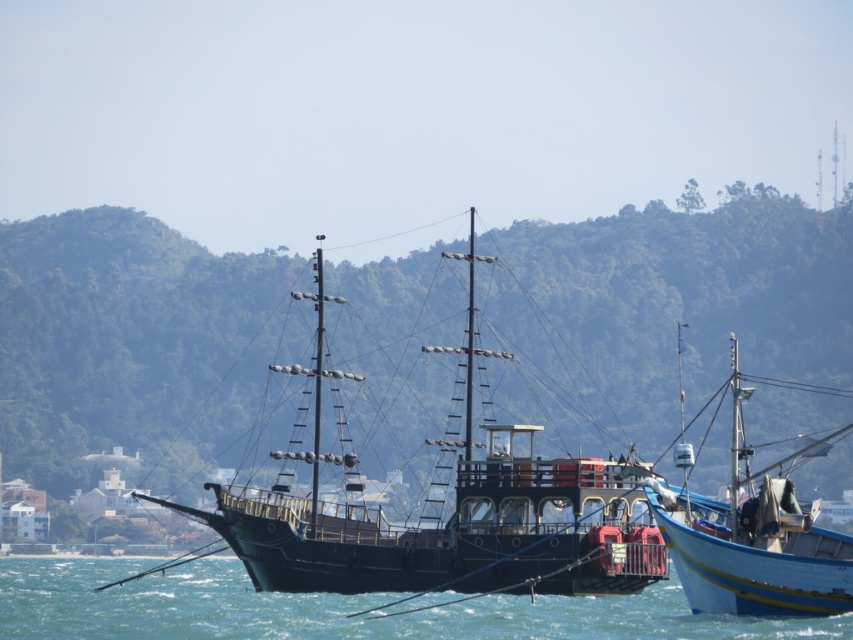
Question: Which object appears closest to the camera in this image?

Choices:
 (A) blue painted wooden boat at right
 (B) blue water at center
 (C) wooden pirate ship at center

Answer: (B)

Question: Considering the real-world distances, which object is closest to the blue painted wooden boat at right?

Choices:
 (A) wooden pirate ship at center
 (B) blue water at center

Answer: (A)

Question: Among these objects, which one is nearest to the camera?

Choices:
 (A) blue painted wooden boat at right
 (B) wooden pirate ship at center
 (C) blue water at center

Answer: (C)

Question: Is blue water at center positioned at the back of blue painted wooden boat at right?

Choices:
 (A) yes
 (B) no

Answer: (B)

Question: Does wooden pirate ship at center have a smaller size compared to blue painted wooden boat at right?

Choices:
 (A) yes
 (B) no

Answer: (A)

Question: Is wooden pirate ship at center wider than blue water at center?

Choices:
 (A) no
 (B) yes

Answer: (A)